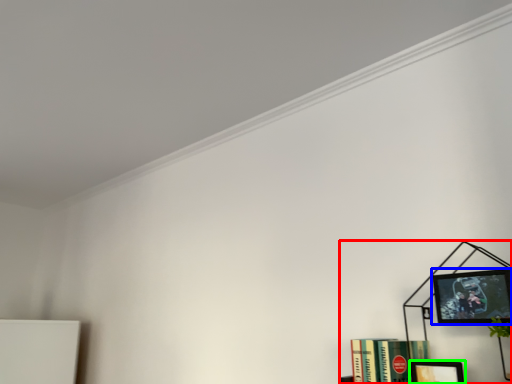
Question: Considering the real-world distances, which object is closest to bookcase (highlighted by a red box)? picture frame (highlighted by a blue box) or picture frame (highlighted by a green box).

Choices:
 (A) picture frame
 (B) picture frame

Answer: (B)